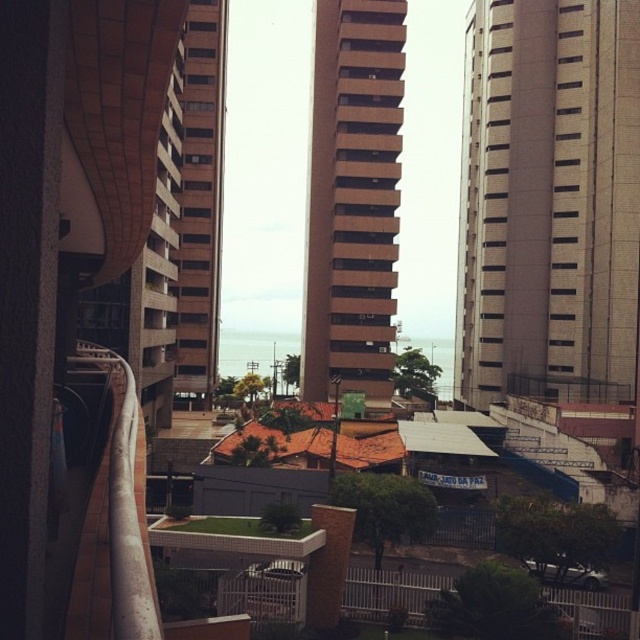
You are standing on the balcony and want to take a photo of the gray concrete building at center. Where should you aim your camera to capture it in the frame?

The gray concrete building at center is located at point 2D coordinates [548,202], so you should aim your camera towards that position to capture it in the frame.

From the picture: You are standing on a balcony and want to compare the sizes of the brown concrete building at center and the white painted metal railing at left. Which one appears bigger in the scene?

The brown concrete building at center appears bigger than the white painted metal railing at left because it has a larger size compared to it.